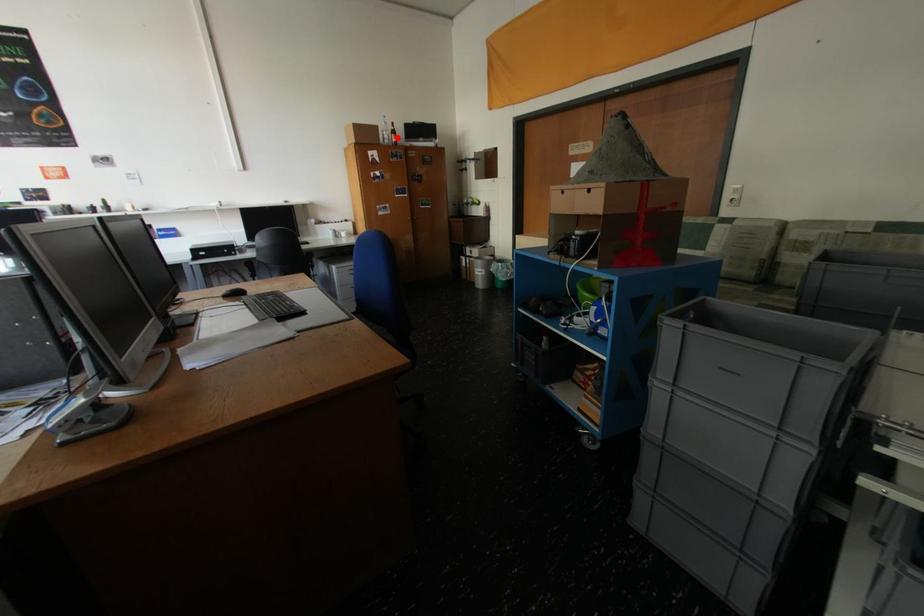
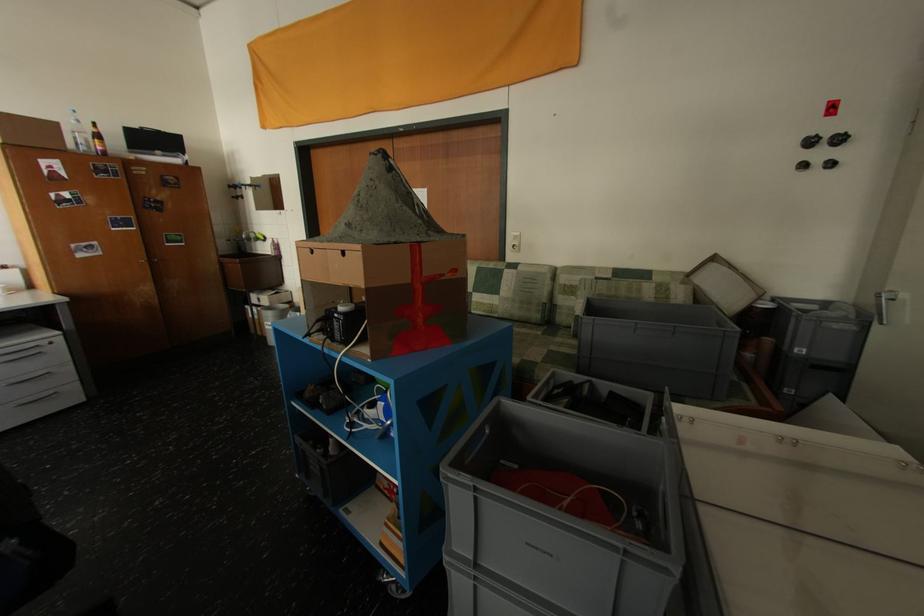
Question: I am providing you with two images of the same scene from different viewpoints. In image1, a red point is highlighted. Considering the same 3D point in image2, which of the following is correct?

Choices:
 (A) It is closer
 (B) It is farther

Answer: (B)